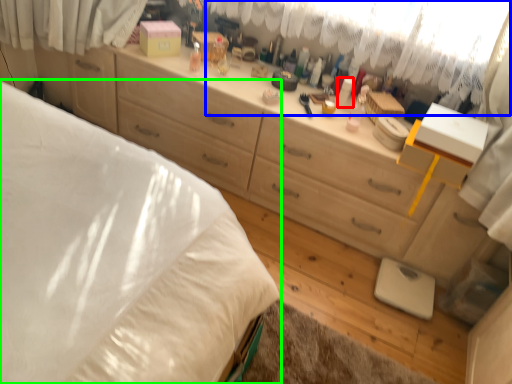
Question: Which object is positioned farthest from toiletry (highlighted by a red box)? Select from curtain (highlighted by a blue box) and bed (highlighted by a green box).

Choices:
 (A) curtain
 (B) bed

Answer: (B)